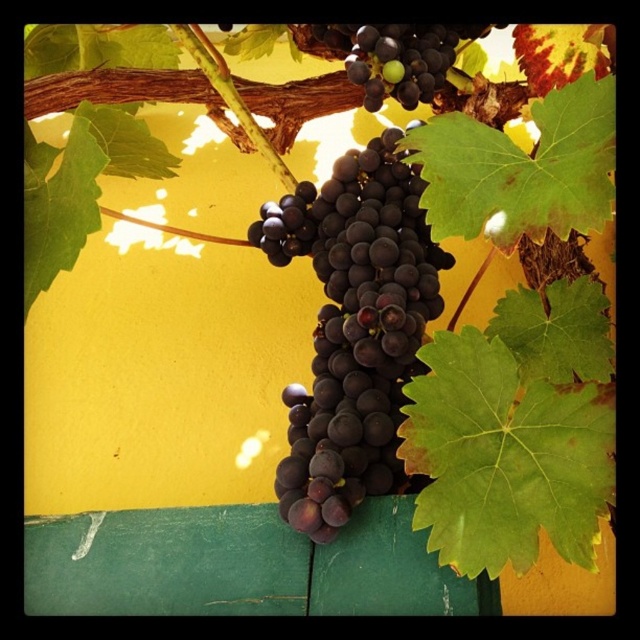
You are an artist trying to paint the grapes scene. You need to decide the order to paint the grapes based on their position. Which point should you paint first, point (381, 204) or point (436, 83)?

Point (381, 204) should be painted first because it is in front of point (436, 83), so it should be painted over the other point.

You are holding a ruler and want to measure the distance from your eyes to the shiny dark purple grapes at center in the image. If the ruler is 12 inches long, can you measure the distance directly with it?

The shiny dark purple grapes at center is 29.68 inches away from viewer, which is longer than the 12 inch ruler. Therefore, you cannot measure the distance directly with the ruler.